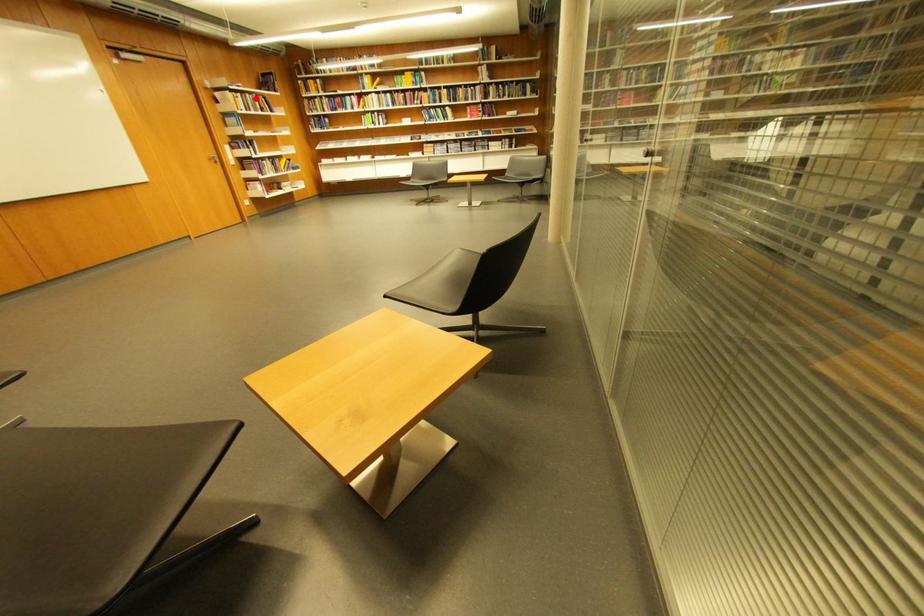
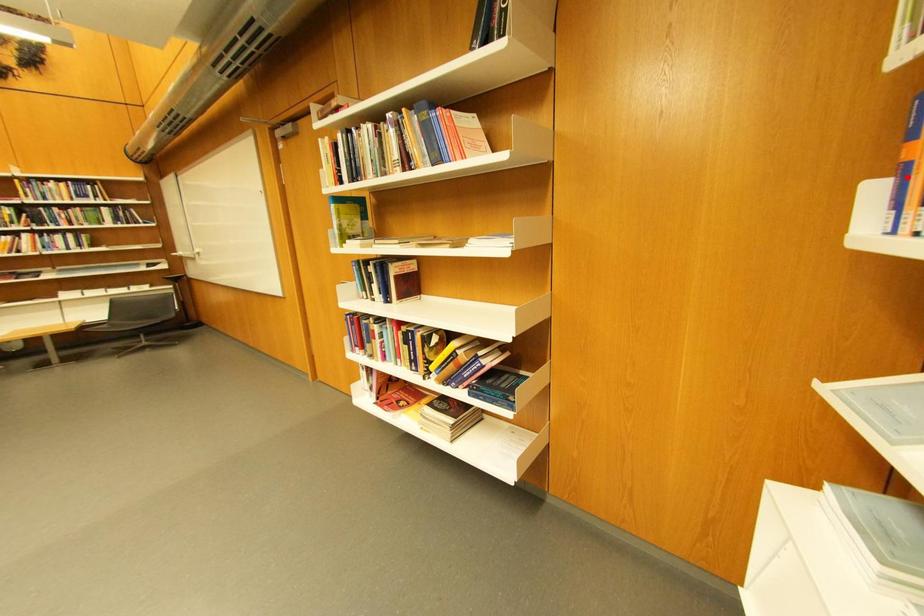
I am providing you with two images of the same scene from different viewpoints. A red point is marked on the first image and another point is marked on the second image. Is the red point in image1 aligned with the point shown in image2?

No